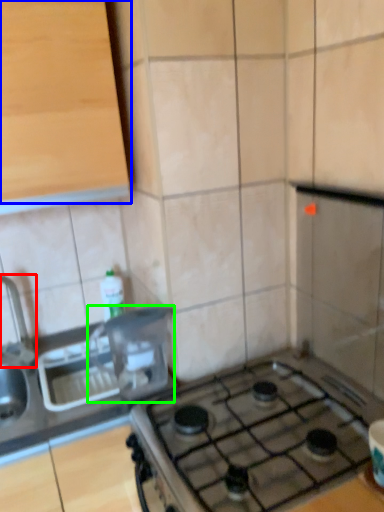
Question: Which object is positioned farthest from faucet (highlighted by a red box)? Select from cabinetry (highlighted by a blue box) and appliance (highlighted by a green box).

Choices:
 (A) cabinetry
 (B) appliance

Answer: (A)